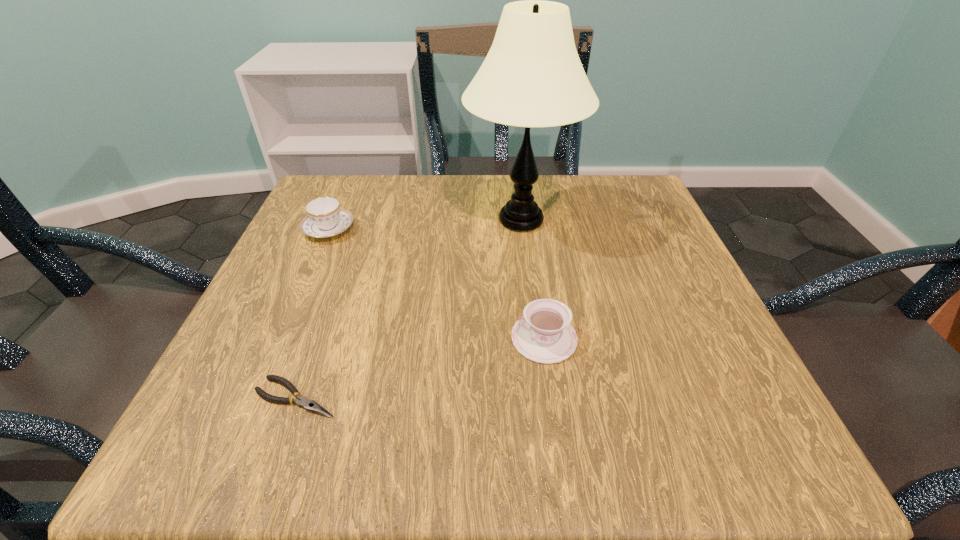
Find the location of `lamp`. lamp is located at coordinates (532, 76).

The image size is (960, 540). I want to click on the farther teacup, so click(325, 218).

This screenshot has height=540, width=960. In order to click on the right teacup in this screenshot , I will do `click(544, 334)`.

You are a GUI agent. You are given a task and a screenshot of the screen. Output one action in this format:
    pyautogui.click(x=<x>, y=<y>)
    Task: Click on the second nearest object
    
    Given the screenshot: What is the action you would take?
    pyautogui.click(x=544, y=334)

Find the location of a particular element. This screenshot has height=540, width=960. the nearest object is located at coordinates (309, 405).

In order to click on the shortest object in this screenshot , I will do `click(309, 405)`.

Identify the location of vacant position located 0.070m on the back of the tallest object. This screenshot has height=540, width=960. (516, 176).

The width and height of the screenshot is (960, 540). Identify the location of vacant area situated on the side with the handle of the left teacup. (347, 188).

The height and width of the screenshot is (540, 960). I want to click on vacant point located 0.110m on the handle side of the right teacup, so click(443, 338).

I want to click on free space located on the handle side of the right teacup, so click(x=418, y=338).